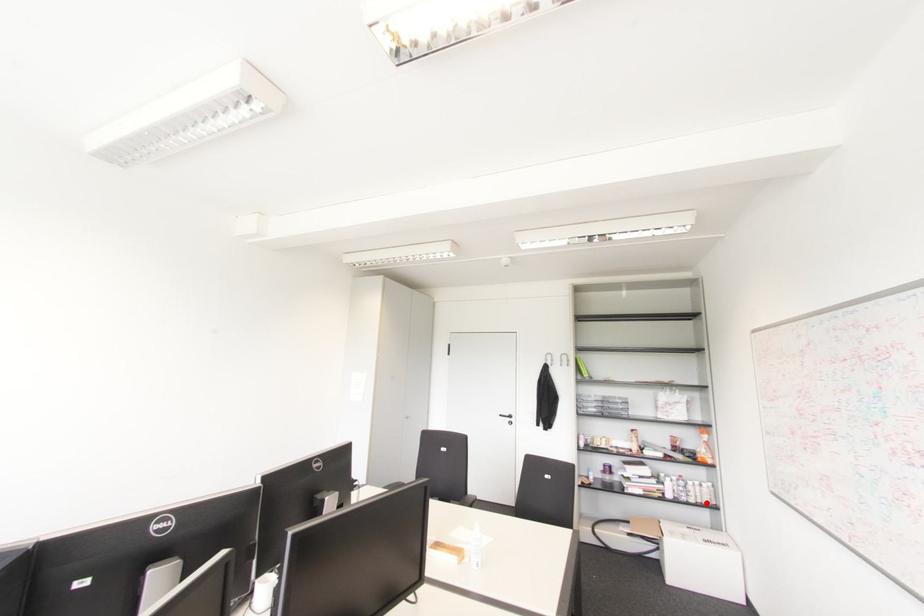
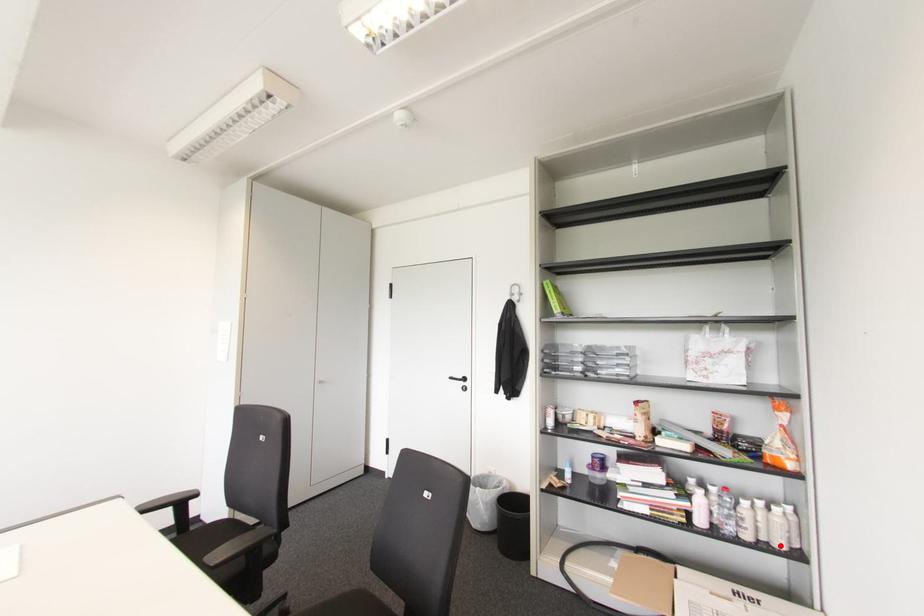
I am providing you with two images of the same scene from different viewpoints. A red point is marked on the first image and another point is marked on the second image. Does the point marked in image1 correspond to the same location as the one in image2?

Yes